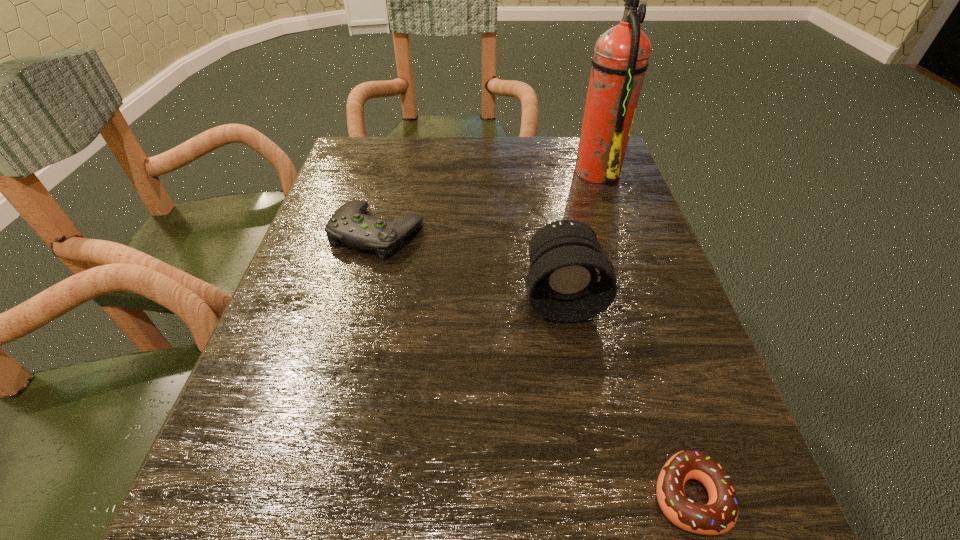
Identify the location of fire extinguisher. The height and width of the screenshot is (540, 960). (621, 55).

This screenshot has height=540, width=960. I want to click on the farthest object, so click(x=621, y=55).

The image size is (960, 540). In order to click on telephoto lens in this screenshot , I will do `click(569, 280)`.

In order to click on the second tallest object in this screenshot , I will do `click(569, 280)`.

What are the coordinates of `control` in the screenshot? It's located at (349, 225).

I want to click on the leftmost object, so click(x=349, y=225).

Find the location of a particular element. The height and width of the screenshot is (540, 960). doughnut is located at coordinates (719, 515).

This screenshot has height=540, width=960. I want to click on free space located at the nozzle of the farthest object, so click(423, 170).

Image resolution: width=960 pixels, height=540 pixels. Find the location of `free space located 0.170m at the nozzle of the farthest object`. free space located 0.170m at the nozzle of the farthest object is located at coordinates (505, 170).

Locate an element on the screen. Image resolution: width=960 pixels, height=540 pixels. blank space located at the nozzle of the farthest object is located at coordinates (505, 170).